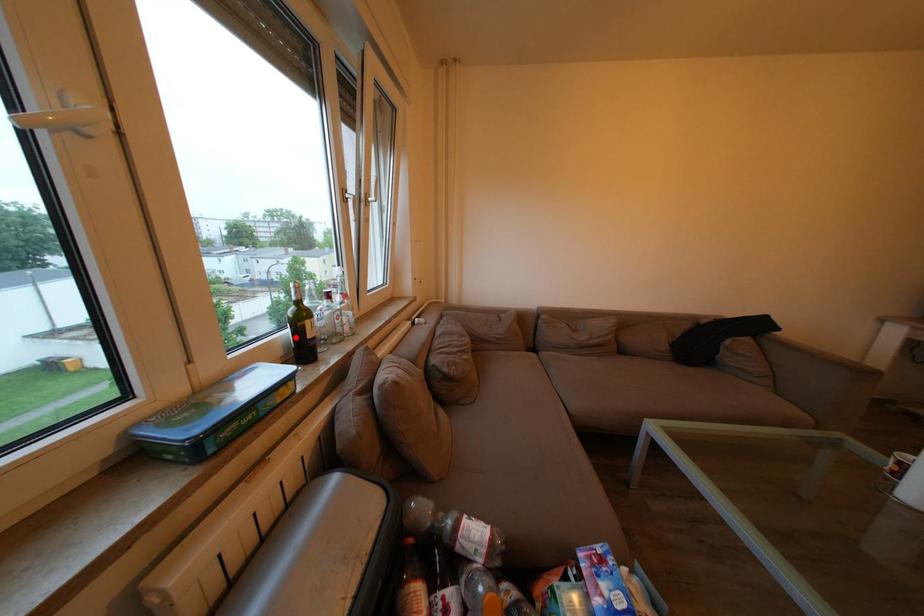
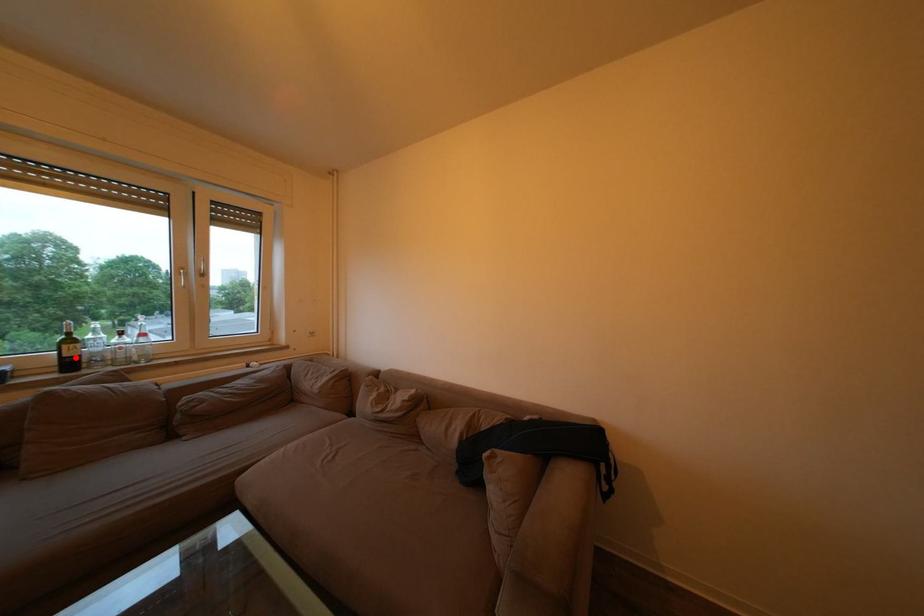
I am providing you with two images of the same scene from different viewpoints. A red point is marked on the first image and another point is marked on the second image. Does the point marked in image1 correspond to the same location as the one in image2?

Yes